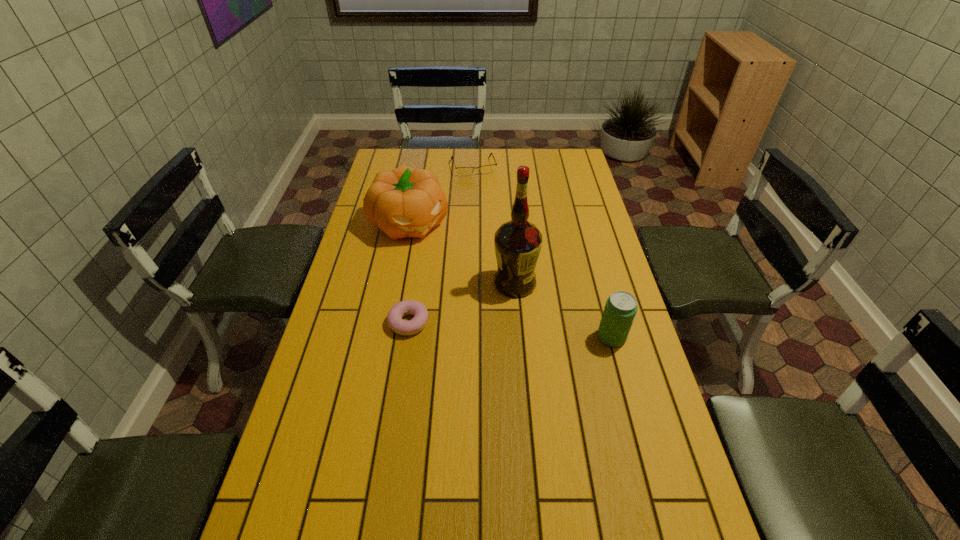
Locate an element on the screen. The height and width of the screenshot is (540, 960). free spot that satisfies the following two spatial constraints: 1. on the front side of the spectacles; 2. on the left side of the alcohol is located at coordinates (471, 284).